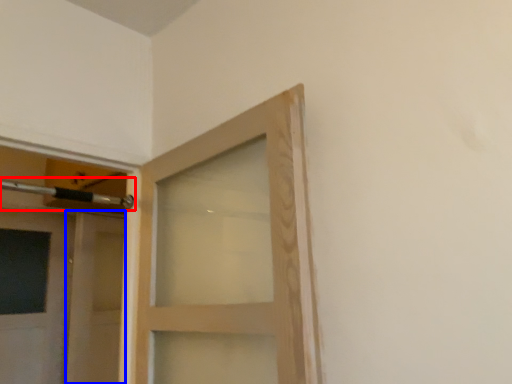
Question: Which point is closer to the camera, door handle (highlighted by a red box) or door (highlighted by a blue box)?

Choices:
 (A) door handle
 (B) door

Answer: (A)